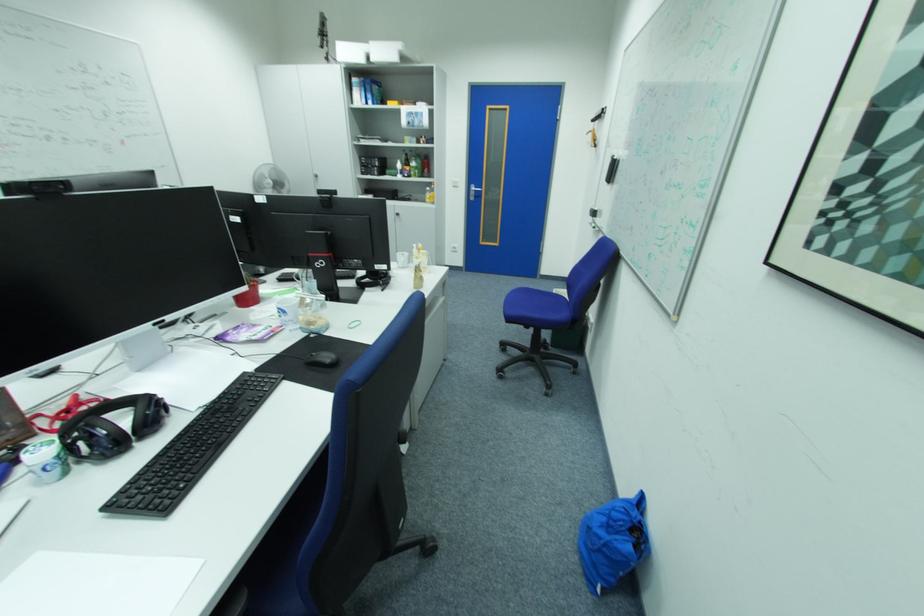
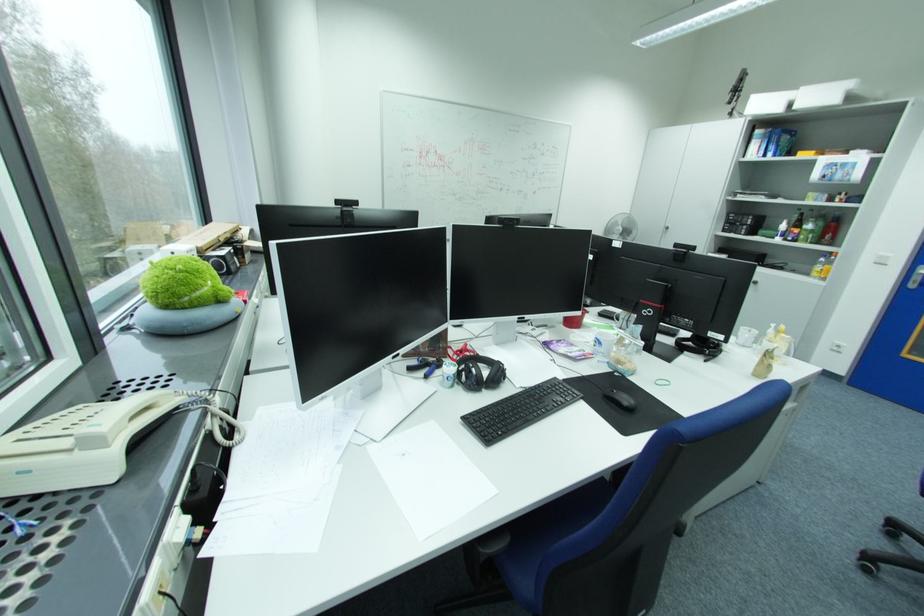
Find the pixel in the second image that matches (x=336, y=362) in the first image.

(635, 405)